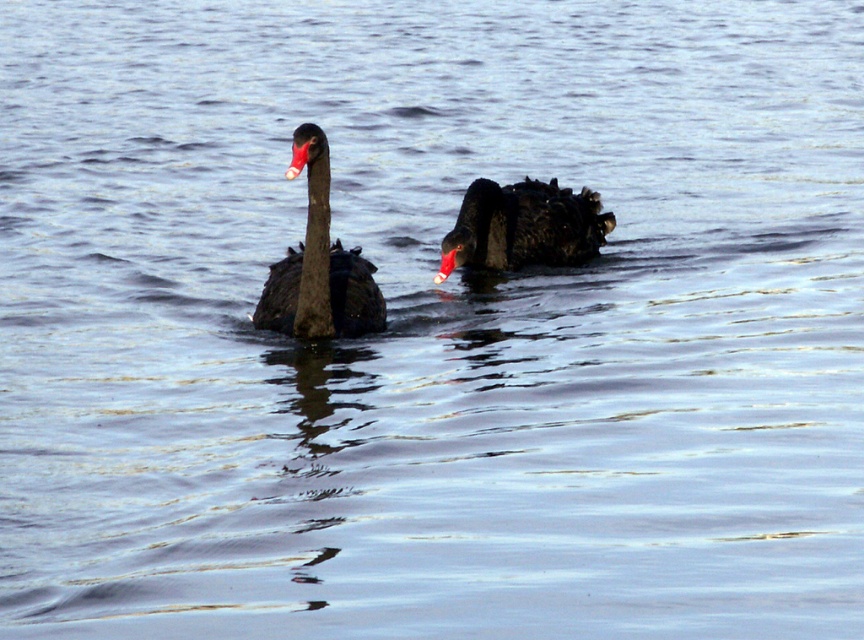
You are a wildlife photographer aiming to capture a closeup shot of the matte black swan at left and the shiny black swan at center. Given that your camera lens can only focus on one swan at a time, which swan should you choose to ensure the largest subject in your frame?

The matte black swan at left is larger in size compared to the shiny black swan at center, so choosing to focus on the matte black swan at left will result in a larger subject in your frame.

You are standing on the edge of a lake and see a point marked at coordinates (318,266). What object is located at that point?

The point at coordinates (318,266) indicates the location of the matte black swan at left.

You are a wildlife photographer aiming to capture a closeup shot of both the matte black swan at left and the shiny black swan at center. Given that your camera lens can only focus on objects within a 1.2 meter width, will you need to adjust your position to accommodate both swans?

The matte black swan at left has a lesser width compared to the shiny black swan at center, so the total width of both swans combined may exceed the 1.2 meter focus range. You may need to adjust your position to ensure both fit within the camera lens focus area.